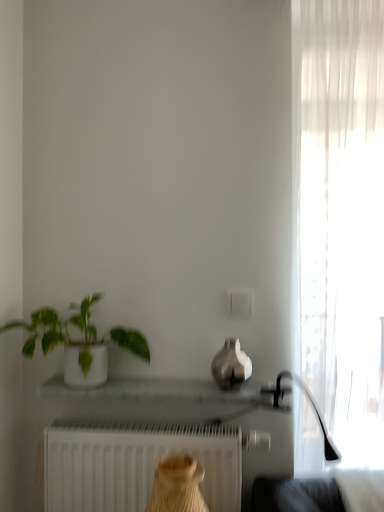
The width and height of the screenshot is (384, 512). I want to click on free space to the left of satin silver vase at center, so click(180, 384).